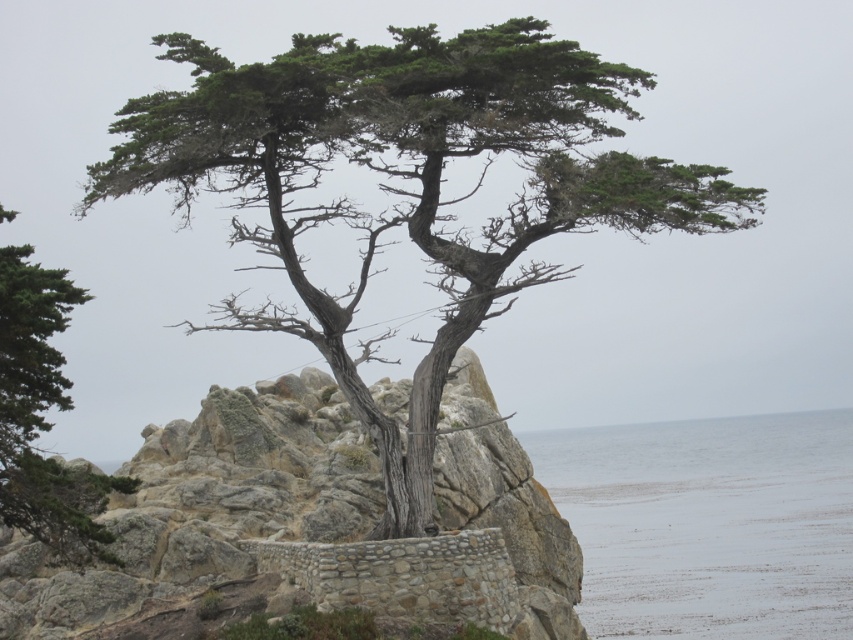
Question: Considering the real-world distances, which object is closest to the gray stone rock at center?

Choices:
 (A) gray/smooth water at lower center
 (B) green textured tree at left
 (C) green textured tree at center

Answer: (C)

Question: Does green textured tree at center have a lesser width compared to gray/smooth water at lower center?

Choices:
 (A) yes
 (B) no

Answer: (B)

Question: Does gray stone rock at center have a larger size compared to green textured tree at left?

Choices:
 (A) no
 (B) yes

Answer: (B)

Question: Among these objects, which one is nearest to the camera?

Choices:
 (A) green textured tree at left
 (B) gray/smooth water at lower center
 (C) green textured tree at center
 (D) gray stone rock at center

Answer: (A)

Question: Is gray stone rock at center in front of gray/smooth water at lower center?

Choices:
 (A) no
 (B) yes

Answer: (B)

Question: Estimate the real-world distances between objects in this image. Which object is closer to the green textured tree at center?

Choices:
 (A) green textured tree at left
 (B) gray stone rock at center
 (C) gray/smooth water at lower center

Answer: (B)